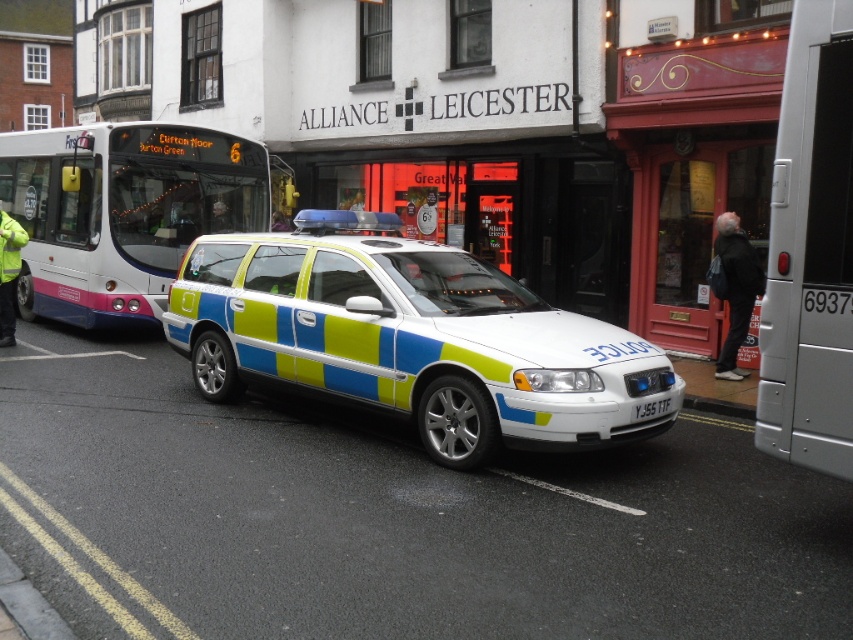
You are a pedestrian standing at the point marked by the coordinates point (810, 252). Which vehicle are you closest to?

The point (810, 252) corresponds to the metallic silver van at right, so you are closest to the metallic silver van at right.

You are a toy collector who wants to display the white plastic bus at center and the white plastic license plate at center together. Since you have limited space, you need to know which one takes up more space. Which object is bigger?

The white plastic bus at center is larger in size compared to the white plastic license plate at center, so it takes up more space.

In the scene shown: You are a pedestrian standing at the bus stop. You want to cross the road to the park on the other side. There is a white glossy police car at center and a metallic silver van at right. Can you safely cross the road between them without getting too close?

The white glossy police car at center is 3.12 meters away from metallic silver van at right. Since 3.12 meters is approximately 10.2 feet, there is enough space for a pedestrian to cross safely between them without getting too close.